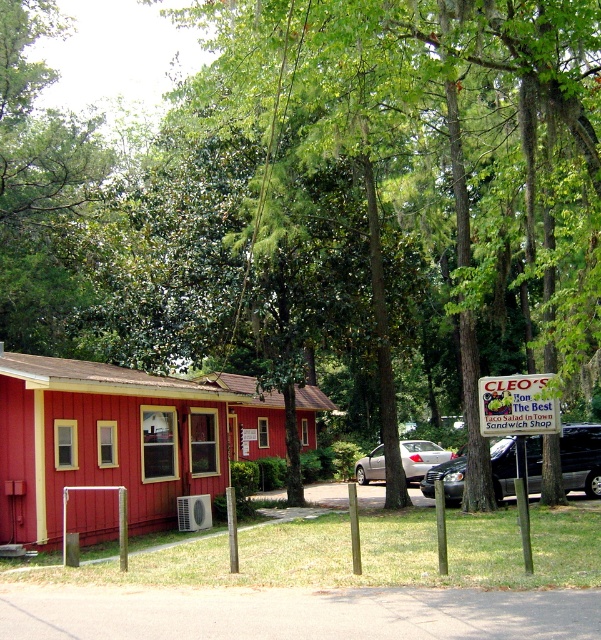
Can you confirm if red wood cabin at center is thinner than silver metallic sedan at center?

No.

In the scene shown: Between red wood cabin at center and silver metallic sedan at center, which one has less height?

silver metallic sedan at center

Is point (254, 385) positioned before point (418, 470)?

No, it is behind (418, 470).

Locate an element on the screen. Image resolution: width=601 pixels, height=640 pixels. red wood cabin at center is located at coordinates (251, 417).

Consider the image. Is matte wood cabin at center to the left of red wood cabin at center from the viewer's perspective?

Correct, you'll find matte wood cabin at center to the left of red wood cabin at center.

Can you confirm if matte wood cabin at center is positioned to the right of red wood cabin at center?

Incorrect, matte wood cabin at center is not on the right side of red wood cabin at center.

Is point (94, 420) positioned in front of point (314, 436)?

That is True.

This screenshot has height=640, width=601. Find the location of `matte wood cabin at center`. matte wood cabin at center is located at coordinates (108, 440).

This screenshot has height=640, width=601. What do you see at coordinates (427, 172) in the screenshot?
I see `green leafy tree at center` at bounding box center [427, 172].

Can you confirm if green leafy tree at center is positioned below matte wood cabin at center?

No.

At what (x,y) coordinates should I click in order to perform the action: click on green leafy tree at center. Please return your answer as a coordinate pair (x, y). The image size is (601, 640). Looking at the image, I should click on (427, 172).

Locate an element on the screen. The width and height of the screenshot is (601, 640). green leafy tree at center is located at coordinates tap(427, 172).